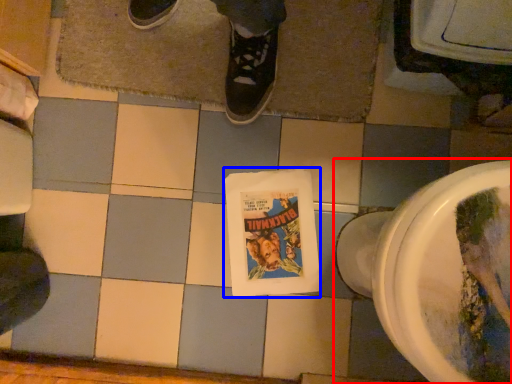
Question: Which point is further to the camera, toilet (highlighted by a red box) or comic book (highlighted by a blue box)?

Choices:
 (A) toilet
 (B) comic book

Answer: (B)